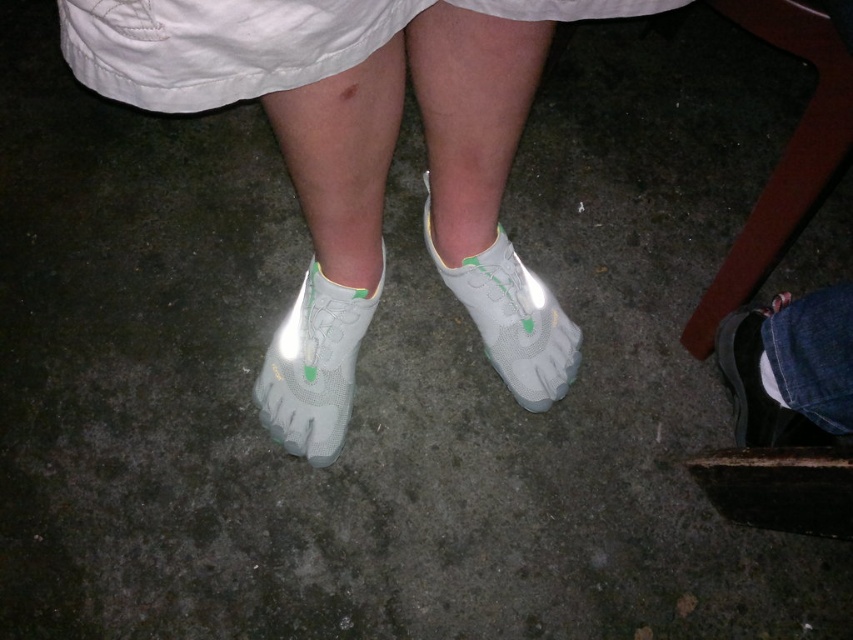
Which is in front, point (837, 397) or point (746, 372)?

Point (837, 397) is in front.

Is denim pants at lower right to the left of matte black shoe at lower right from the viewer's perspective?

No, denim pants at lower right is not to the left of matte black shoe at lower right.

Locate an element on the screen. Image resolution: width=853 pixels, height=640 pixels. denim pants at lower right is located at coordinates (790, 369).

The width and height of the screenshot is (853, 640). I want to click on denim pants at lower right, so click(790, 369).

Is point (515, 355) positioned before point (753, 433)?

No, it is behind (753, 433).

Is white mesh shoe at center above matte black shoe at lower right?

Yes.

Is point (479, 330) closer to camera compared to point (770, 310)?

No, it is behind (770, 310).

The image size is (853, 640). I want to click on white mesh shoe at center, so click(x=512, y=317).

Can you confirm if denim pants at lower right is taller than white mesh shoe at center?

Incorrect, denim pants at lower right's height is not larger of white mesh shoe at center's.

Does denim pants at lower right appear under white mesh shoe at center?

Yes.

The width and height of the screenshot is (853, 640). Describe the element at coordinates (790, 369) in the screenshot. I see `denim pants at lower right` at that location.

The height and width of the screenshot is (640, 853). I want to click on denim pants at lower right, so click(790, 369).